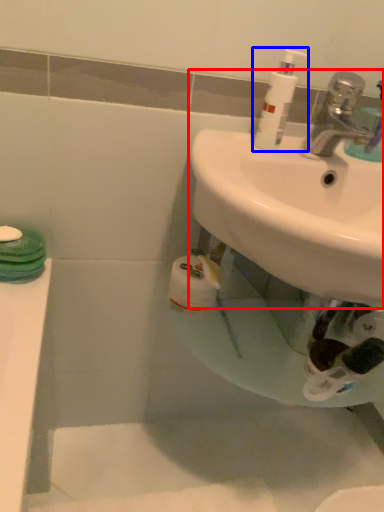
Question: Which point is closer to the camera, sink (highlighted by a red box) or cleaning product (highlighted by a blue box)?

Choices:
 (A) sink
 (B) cleaning product

Answer: (A)